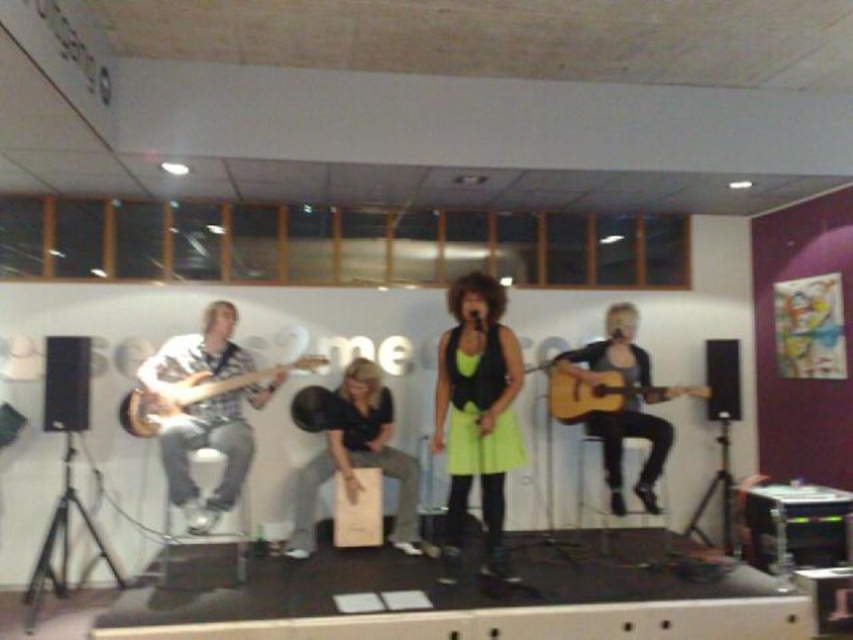
Question: Which of the following is the closest to the observer?

Choices:
 (A) (619, 406)
 (B) (245, 381)
 (C) (502, 406)
 (D) (462, 356)

Answer: (C)

Question: Where is matte black guitar at left located in relation to matte black guitar at right in the image?

Choices:
 (A) left
 (B) right

Answer: (A)

Question: Can you confirm if matte black guitar at left is positioned below neon yellow dress at center?

Choices:
 (A) yes
 (B) no

Answer: (A)

Question: Among these objects, which one is farthest from the camera?

Choices:
 (A) acoustic wood guitar at center
 (B) matte black guitar at left
 (C) wooden electric guitar at left
 (D) matte wood electric guitar at left

Answer: (A)

Question: Is matte black guitar at left below matte black guitar at right?

Choices:
 (A) no
 (B) yes

Answer: (B)

Question: Which is farther from the matte black guitar at left?

Choices:
 (A) neon yellow dress at center
 (B) acoustic wood guitar at center

Answer: (B)